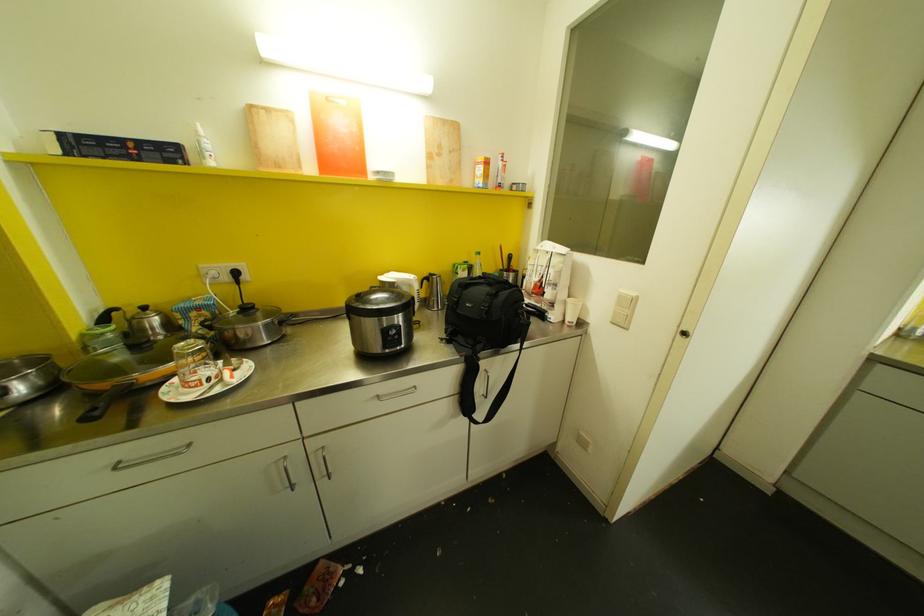
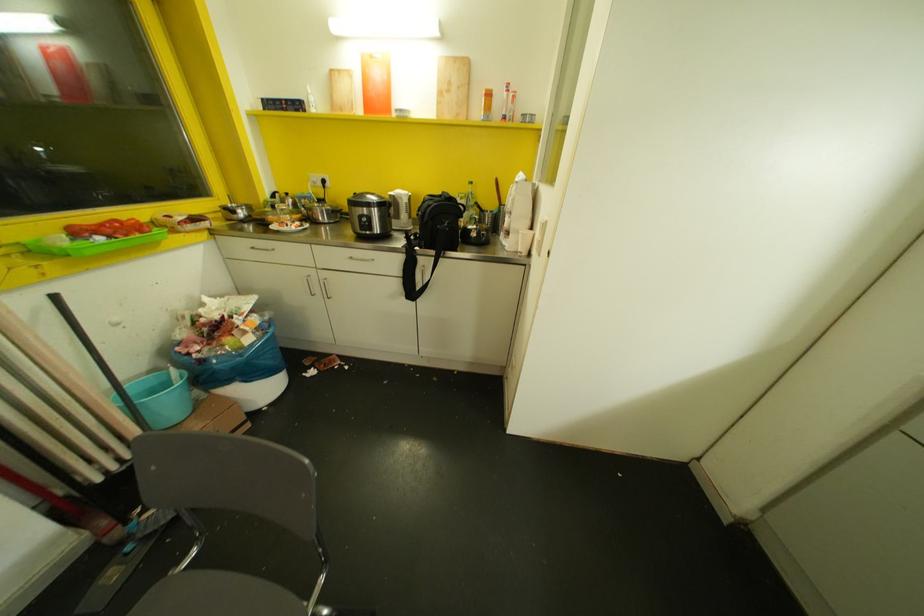
The point at (247,309) is marked in the first image. Where is the corresponding point in the second image?

(320, 200)